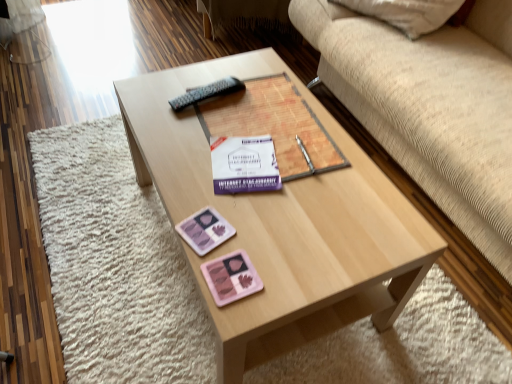
The image size is (512, 384). What are the coordinates of `vacant space positioned to the left of purple matte book at center` in the screenshot? It's located at (164, 121).